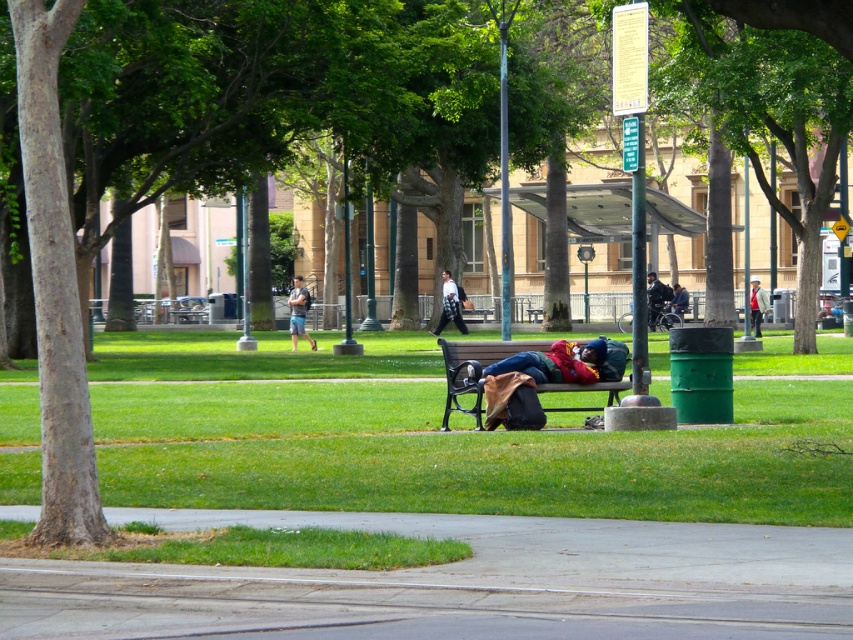
Question: Is green leafy tree at center wider than wooden bench at center?

Choices:
 (A) no
 (B) yes

Answer: (B)

Question: Which object is closer to the camera taking this photo?

Choices:
 (A) dark blue jeans at center
 (B) denim shorts at center
 (C) red plaid blanket at center
 (D) white cotton shirt at center

Answer: (C)

Question: Among these points, which one is farthest from the camera?

Choices:
 (A) (653, 273)
 (B) (567, 365)
 (C) (440, 328)

Answer: (A)

Question: Can you confirm if gray concrete pavement at lower center is wider than light brown leather jacket at center?

Choices:
 (A) no
 (B) yes

Answer: (A)

Question: Can you confirm if white cotton shirt at center is positioned below light brown leather jacket at center?

Choices:
 (A) no
 (B) yes

Answer: (B)

Question: Which point appears closest to the camera in this image?

Choices:
 (A) click(457, 307)
 (B) click(676, 305)
 (C) click(299, 292)
 (D) click(711, 0)

Answer: (D)